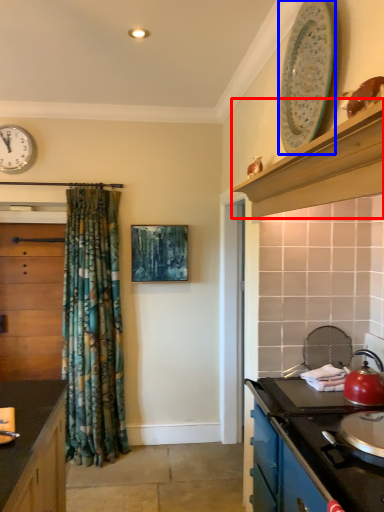
Question: Which point is further to the camera, curved shelf (highlighted by a red box) or appliance (highlighted by a blue box)?

Choices:
 (A) curved shelf
 (B) appliance

Answer: (B)